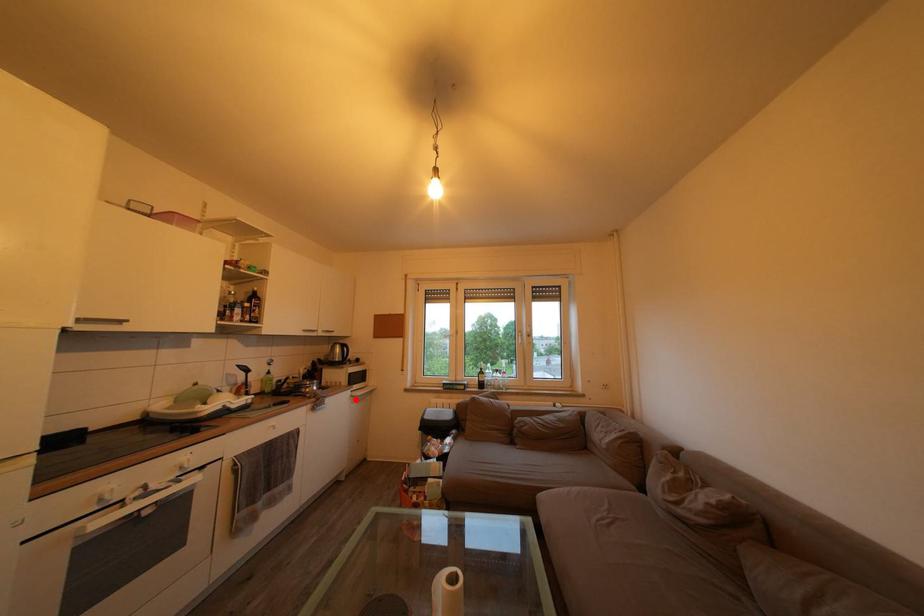
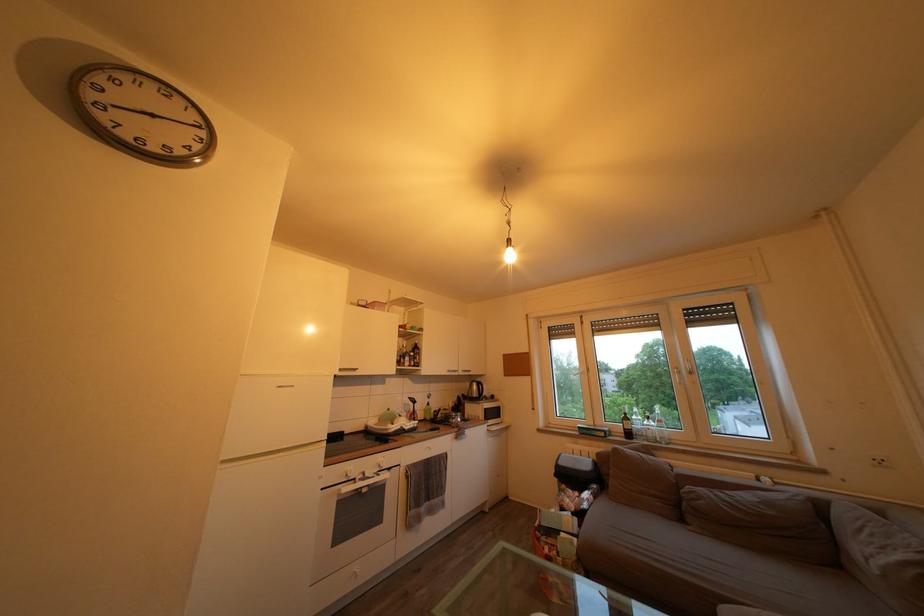
Find the pixel in the second image that matches the highlighted location in the first image.

(492, 434)